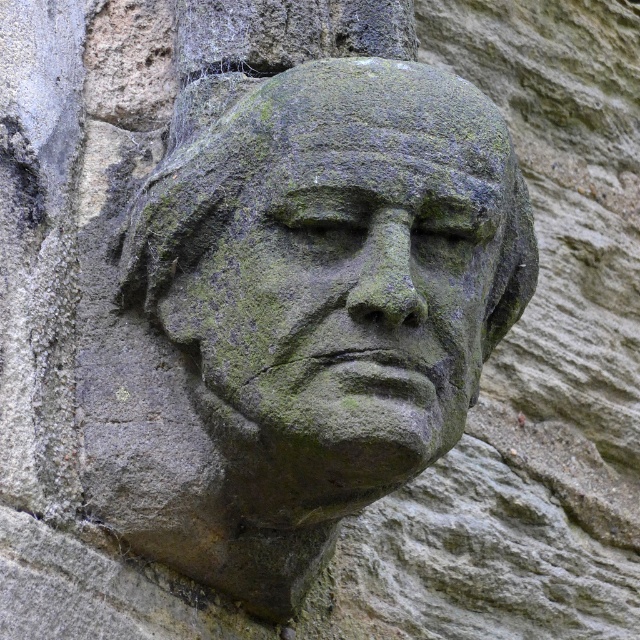
Question: Which object is farther from the camera taking this photo?

Choices:
 (A) green mossy stone head at center
 (B) green mossy stone face at center

Answer: (A)

Question: Is green mossy stone head at center closer to the viewer compared to green mossy stone face at center?

Choices:
 (A) yes
 (B) no

Answer: (B)

Question: Is green mossy stone head at center positioned in front of green mossy stone face at center?

Choices:
 (A) no
 (B) yes

Answer: (A)

Question: Among these points, which one is farthest from the camera?

Choices:
 (A) (474, 388)
 (B) (417, 364)

Answer: (A)

Question: Is green mossy stone head at center further to camera compared to green mossy stone face at center?

Choices:
 (A) no
 (B) yes

Answer: (B)